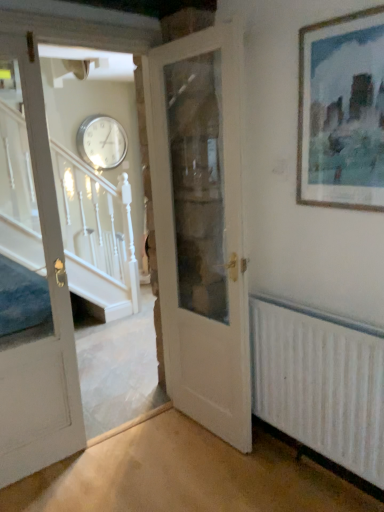
Describe the element at coordinates (201, 226) in the screenshot. I see `white wooden door at center, the 2th door from the left` at that location.

Locate an element on the screen. The image size is (384, 512). white painted wood door at left, the first door viewed from the left is located at coordinates (32, 283).

Which object is closer to the camera taking this photo, white painted wood door at left, the first door viewed from the left, or silver metallic clock at upper center?

white painted wood door at left, the first door viewed from the left.

Is white painted wood door at left, arranged as the 2th door when viewed from the right, situated inside silver metallic clock at upper center or outside?

white painted wood door at left, arranged as the 2th door when viewed from the right, lies outside silver metallic clock at upper center.

Can you confirm if white painted wood door at left, arranged as the 2th door when viewed from the right, is thinner than silver metallic clock at upper center?

Incorrect, the width of white painted wood door at left, arranged as the 2th door when viewed from the right, is not less than that of silver metallic clock at upper center.

Is white painted wood door at left, the first door viewed from the left, far away from silver metallic clock at upper center?

Indeed, white painted wood door at left, the first door viewed from the left, is not near silver metallic clock at upper center.

Is silver metallic clock at upper center looking in the opposite direction of wooden picture frame at upper right?

silver metallic clock at upper center does not have its back to wooden picture frame at upper right.

Is silver metallic clock at upper center inside or outside of wooden picture frame at upper right?

silver metallic clock at upper center cannot be found inside wooden picture frame at upper right.

Who is shorter, silver metallic clock at upper center or wooden picture frame at upper right?

silver metallic clock at upper center is shorter.

Is silver metallic clock at upper center not near wooden picture frame at upper right?

silver metallic clock at upper center is far away from wooden picture frame at upper right.

Is white textured radiator at lower right placed right next to white wooden door at center, placed as the 1th door when sorted from right to left?

No, white textured radiator at lower right is not next to white wooden door at center, placed as the 1th door when sorted from right to left.

Is white textured radiator at lower right positioned with its back to white wooden door at center, placed as the 1th door when sorted from right to left?

white textured radiator at lower right is not turned away from white wooden door at center, placed as the 1th door when sorted from right to left.

Which point is more distant from viewer, (345,386) or (226,112)?

The point (226,112) is farther from the camera.

Can you tell me how much white textured radiator at lower right and white wooden door at center, placed as the 1th door when sorted from right to left, differ in facing direction?

white textured radiator at lower right and white wooden door at center, placed as the 1th door when sorted from right to left, are facing 3.97 degrees away from each other.

Considering the positions of objects white wooden door at center, the 2th door from the left, and white painted wood door at left, arranged as the 2th door when viewed from the right, in the image provided, who is more to the right, white wooden door at center, the 2th door from the left, or white painted wood door at left, arranged as the 2th door when viewed from the right,?

From the viewer's perspective, white wooden door at center, the 2th door from the left, appears more on the right side.

Which object is thinner, white wooden door at center, the 2th door from the left, or white painted wood door at left, arranged as the 2th door when viewed from the right?

white painted wood door at left, arranged as the 2th door when viewed from the right.

Is white wooden door at center, placed as the 1th door when sorted from right to left, in contact with white painted wood door at left, arranged as the 2th door when viewed from the right?

There is a gap between white wooden door at center, placed as the 1th door when sorted from right to left, and white painted wood door at left, arranged as the 2th door when viewed from the right.

From the image's perspective, is white wooden door at center, the 2th door from the left, over white painted wood door at left, arranged as the 2th door when viewed from the right?

Yes.

In the scene shown: Is white wooden door at center, placed as the 1th door when sorted from right to left, shorter than white textured radiator at lower right?

No.

Between white wooden door at center, placed as the 1th door when sorted from right to left, and white textured radiator at lower right, which one is positioned behind?

Positioned behind is white wooden door at center, placed as the 1th door when sorted from right to left.

At what (x,y) coordinates should I click in order to perform the action: click on door that is the 2nd one when counting upward from the white textured radiator at lower right (from the image's perspective). Please return your answer as a coordinate pair (x, y). This screenshot has width=384, height=512. Looking at the image, I should click on (201, 226).

Based on the photo, does white wooden door at center, the 2th door from the left, turn towards white textured radiator at lower right?

No.

Which object is further away from the camera taking this photo, silver metallic clock at upper center or white wooden door at center, the 2th door from the left?

silver metallic clock at upper center.

This screenshot has height=512, width=384. What are the coordinates of `clock lying behind the white wooden door at center, the 2th door from the left` in the screenshot? It's located at (101, 142).

Does silver metallic clock at upper center appear on the right side of white wooden door at center, the 2th door from the left?

No.

Does wooden picture frame at upper right have a smaller size compared to silver metallic clock at upper center?

Yes, wooden picture frame at upper right is smaller than silver metallic clock at upper center.

Between wooden picture frame at upper right and silver metallic clock at upper center, which one has larger width?

silver metallic clock at upper center.

From the image's perspective, is wooden picture frame at upper right on silver metallic clock at upper center?

No.

Are wooden picture frame at upper right and silver metallic clock at upper center far apart?

wooden picture frame at upper right is positioned a significant distance from silver metallic clock at upper center.

Locate an element on the screen. This screenshot has height=512, width=384. the 2nd door positioned below the silver metallic clock at upper center (from the image's perspective) is located at coordinates (32, 283).

Where is `clock located above the wooden picture frame at upper right (from the image's perspective)`? clock located above the wooden picture frame at upper right (from the image's perspective) is located at coordinates (101, 142).

Based on their spatial positions, is silver metallic clock at upper center or white painted wood door at left, the first door viewed from the left, closer to white textured radiator at lower right?

white painted wood door at left, the first door viewed from the left, is closer to white textured radiator at lower right.

Based on their spatial positions, is white wooden door at center, placed as the 1th door when sorted from right to left, or wooden picture frame at upper right further from white textured radiator at lower right?

wooden picture frame at upper right is positioned further to the anchor white textured radiator at lower right.

Considering their positions, is white textured radiator at lower right positioned further to wooden picture frame at upper right than white wooden door at center, the 2th door from the left?

white textured radiator at lower right is further to wooden picture frame at upper right.

Based on their spatial positions, is white wooden door at center, the 2th door from the left, or wooden picture frame at upper right closer to white painted wood door at left, the first door viewed from the left?

white wooden door at center, the 2th door from the left.

Looking at the image, which one is located further to white painted wood door at left, arranged as the 2th door when viewed from the right, white wooden door at center, the 2th door from the left, or silver metallic clock at upper center?

silver metallic clock at upper center is further to white painted wood door at left, arranged as the 2th door when viewed from the right.

When comparing their distances from silver metallic clock at upper center, does white textured radiator at lower right or white wooden door at center, the 2th door from the left, seem closer?

white wooden door at center, the 2th door from the left, is positioned closer to the anchor silver metallic clock at upper center.

From the image, which object appears to be nearer to white textured radiator at lower right, white painted wood door at left, the first door viewed from the left, or silver metallic clock at upper center?

white painted wood door at left, the first door viewed from the left, is positioned closer to the anchor white textured radiator at lower right.

When comparing their distances from silver metallic clock at upper center, does white textured radiator at lower right or white painted wood door at left, the first door viewed from the left, seem further?

white textured radiator at lower right is further to silver metallic clock at upper center.

This screenshot has height=512, width=384. I want to click on door located between white painted wood door at left, the first door viewed from the left, and silver metallic clock at upper center in the depth direction, so click(x=201, y=226).

Locate an element on the screen. This screenshot has width=384, height=512. door situated between white painted wood door at left, the first door viewed from the left, and white textured radiator at lower right from left to right is located at coordinates (201, 226).

You are a GUI agent. You are given a task and a screenshot of the screen. Output one action in this format:
    pyautogui.click(x=<x>, y=<y>)
    Task: Click on the radiator between wooden picture frame at upper right and silver metallic clock at upper center from front to back
    The height and width of the screenshot is (512, 384).
    Given the screenshot: What is the action you would take?
    coord(320,383)

Where is `door located between white painted wood door at left, the first door viewed from the left, and wooden picture frame at upper right in the left-right direction`? This screenshot has width=384, height=512. door located between white painted wood door at left, the first door viewed from the left, and wooden picture frame at upper right in the left-right direction is located at coordinates (201, 226).